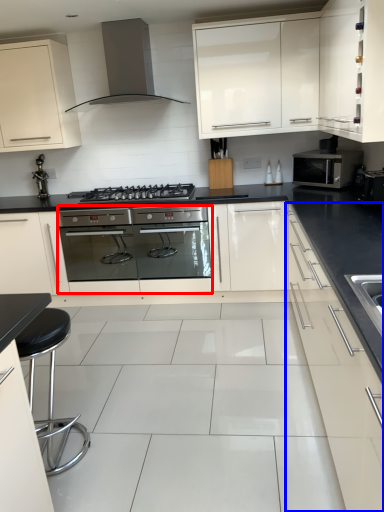
Question: Among these objects, which one is farthest to the camera, oven (highlighted by a red box) or cabinetry (highlighted by a blue box)?

Choices:
 (A) oven
 (B) cabinetry

Answer: (A)